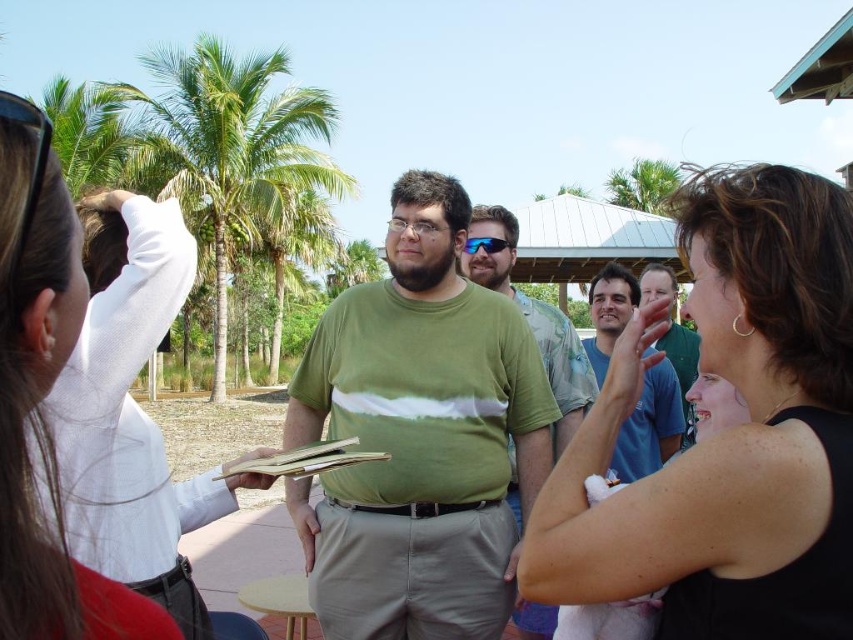
Question: Considering the relative positions of blue cotton shirt at center and green leafy palm tree at upper center in the image provided, where is blue cotton shirt at center located with respect to green leafy palm tree at upper center?

Choices:
 (A) right
 (B) left

Answer: (B)

Question: Which point appears farthest from the camera in this image?

Choices:
 (A) (693, 369)
 (B) (3, 136)
 (C) (45, 122)

Answer: (A)

Question: Which point is closer to the camera?

Choices:
 (A) green matte t-shirt at center
 (B) green leafy palm tree at upper left
 (C) blue cotton shirt at center
 (D) black plastic sunglasses at upper left

Answer: (D)

Question: Can you confirm if blue cotton shirt at center is thinner than blue reflective lens sunglasses at center?

Choices:
 (A) yes
 (B) no

Answer: (B)

Question: Does green matte shirt at center lie behind green leafy palm tree at upper center?

Choices:
 (A) no
 (B) yes

Answer: (A)

Question: Which object appears farthest from the camera in this image?

Choices:
 (A) green matte t-shirt at center
 (B) blue reflective lens sunglasses at center
 (C) blue cotton shirt at center
 (D) white fabric at left

Answer: (B)